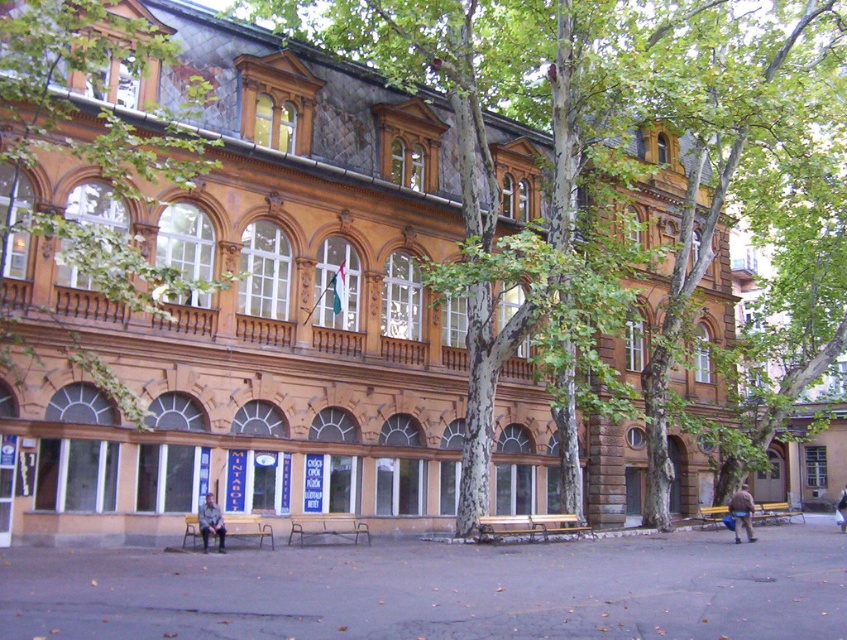
Can you confirm if green textured tree at center is bigger than metallic silver bench at center?

Indeed, green textured tree at center has a larger size compared to metallic silver bench at center.

Based on the photo, can you confirm if green textured tree at center is shorter than metallic silver bench at center?

No, green textured tree at center is not shorter than metallic silver bench at center.

Is point (477, 326) behind point (363, 531)?

No, (477, 326) is closer to viewer.

Identify the location of green textured tree at center. (580, 144).

Can you confirm if metallic silver bench at center is thinner than white cotton shirt at center?

Yes.

The width and height of the screenshot is (847, 640). Describe the element at coordinates (328, 529) in the screenshot. I see `metallic silver bench at center` at that location.

Does point (333, 524) lie behind point (840, 490)?

No, it is in front of (840, 490).

Where is `metallic silver bench at center`? metallic silver bench at center is located at coordinates coord(328,529).

Does green leafy tree at center appear over brown fuzzy coat at lower right?

Yes, green leafy tree at center is above brown fuzzy coat at lower right.

Does green leafy tree at center have a smaller size compared to brown fuzzy coat at lower right?

No.

Is point (108, 81) in front of point (746, 513)?

Yes, it is in front of point (746, 513).

Identify the location of green leafy tree at center. This screenshot has width=847, height=640. (92, 145).